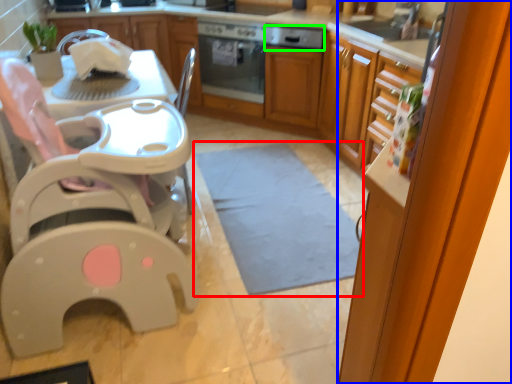
Question: Based on their relative distances, which object is nearer to mat (highlighted by a red box)? Choose from screen door (highlighted by a blue box) and kitchen appliance (highlighted by a green box).

Choices:
 (A) screen door
 (B) kitchen appliance

Answer: (A)